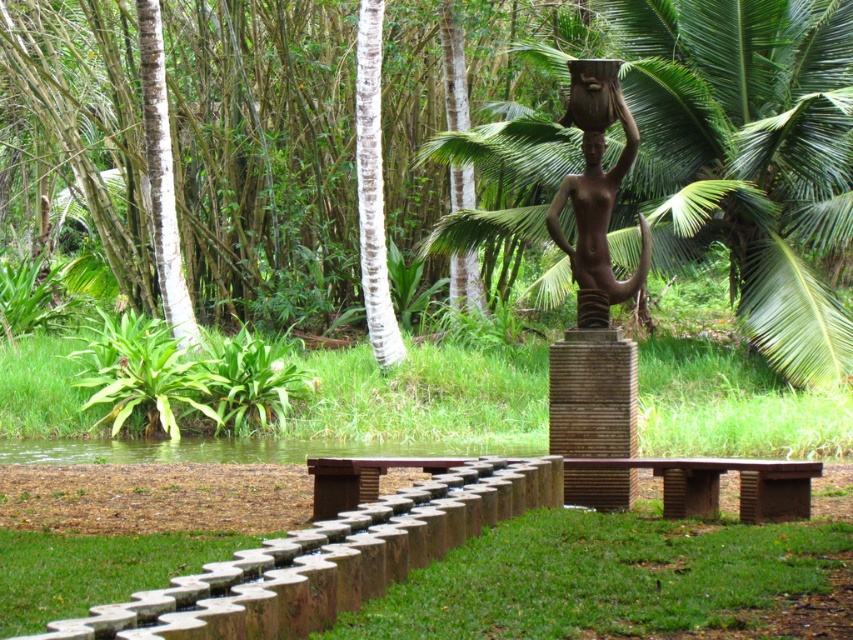
Is bronze statue at center positioned behind brown wooden bench at center?

Yes, it is.

The height and width of the screenshot is (640, 853). What do you see at coordinates (596, 193) in the screenshot?
I see `bronze statue at center` at bounding box center [596, 193].

Locate an element on the screen. The image size is (853, 640). bronze statue at center is located at coordinates (596, 193).

Who is shorter, bronze statue at center or bronze statue at upper center?

bronze statue at upper center is shorter.

Does bronze statue at center have a larger size compared to bronze statue at upper center?

Yes, bronze statue at center is bigger than bronze statue at upper center.

Is point (585, 93) farther from viewer compared to point (596, 140)?

No, it is in front of (596, 140).

The width and height of the screenshot is (853, 640). What are the coordinates of `bronze statue at center` in the screenshot? It's located at (596, 193).

Between green leafy palm tree at center and bronze statue at upper center, which one appears on the right side from the viewer's perspective?

From the viewer's perspective, green leafy palm tree at center appears more on the right side.

Describe the element at coordinates (746, 157) in the screenshot. I see `green leafy palm tree at center` at that location.

Identify the location of green leafy palm tree at center. (746, 157).